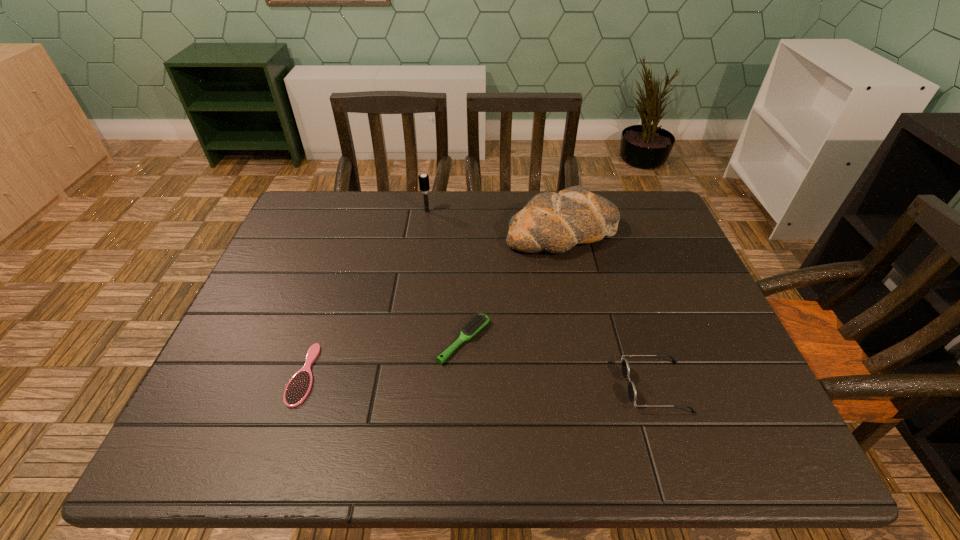
In order to click on vacant space at the far edge of the desktop in this screenshot , I will do `click(387, 208)`.

You are a GUI agent. You are given a task and a screenshot of the screen. Output one action in this format:
    pyautogui.click(x=<x>, y=<y>)
    Task: Click on the vacant space at the near edge of the desktop
    
    Given the screenshot: What is the action you would take?
    pyautogui.click(x=291, y=435)

Find the location of `vacant space at the far left corner of the desktop`. vacant space at the far left corner of the desktop is located at coordinates (303, 230).

Locate an element on the screen. The height and width of the screenshot is (540, 960). free point at the far right corner is located at coordinates (648, 194).

The image size is (960, 540). I want to click on blank region between the fourth tallest object and the third tallest object, so click(560, 363).

Locate an element on the screen. The height and width of the screenshot is (540, 960). vacant space that is in between the rightmost hairbrush and the sunglasses is located at coordinates (560, 363).

This screenshot has height=540, width=960. What are the coordinates of `free space between the leftmost object and the third shortest object` in the screenshot? It's located at pyautogui.click(x=480, y=381).

Identify the location of vacant region between the shortest object and the farthest hairbrush. The width and height of the screenshot is (960, 540). (366, 293).

Where is `vacant region between the second shortest object and the leftmost hairbrush`? The image size is (960, 540). vacant region between the second shortest object and the leftmost hairbrush is located at coordinates (384, 357).

Where is `empty space between the fourth object from right to left and the shortest hairbrush`? This screenshot has height=540, width=960. empty space between the fourth object from right to left and the shortest hairbrush is located at coordinates (366, 293).